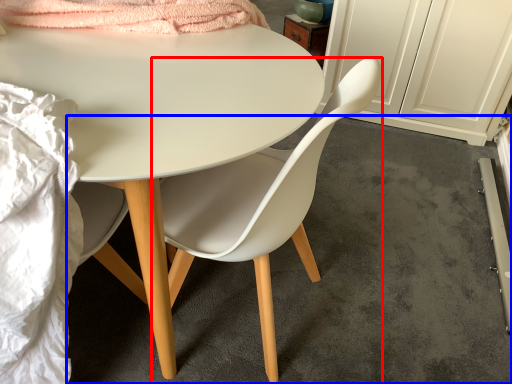
Question: Which object appears farthest to the camera in this image, chair (highlighted by a red box) or concrete (highlighted by a blue box)?

Choices:
 (A) chair
 (B) concrete

Answer: (B)